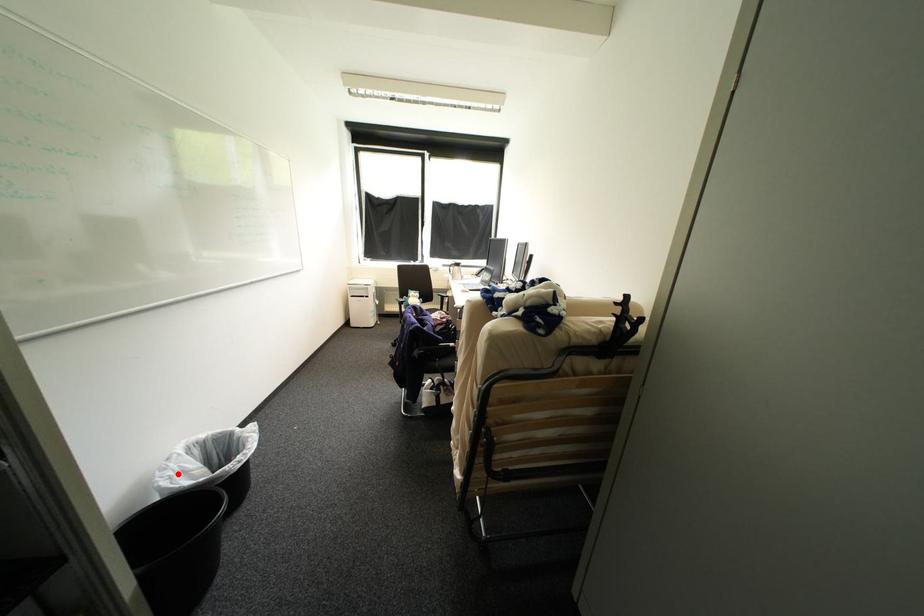
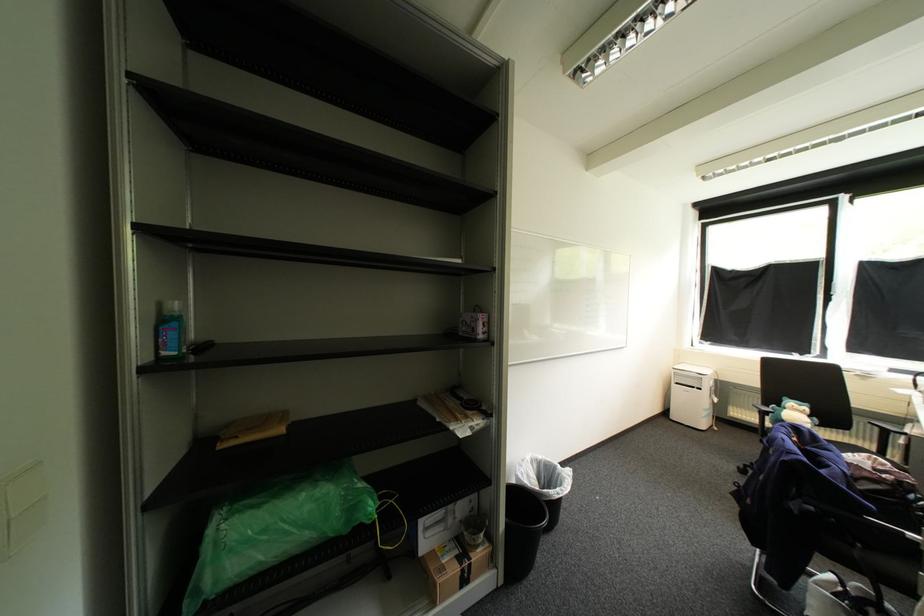
Locate, in the second image, the point that corresponds to the highlighted location in the first image.

(529, 472)